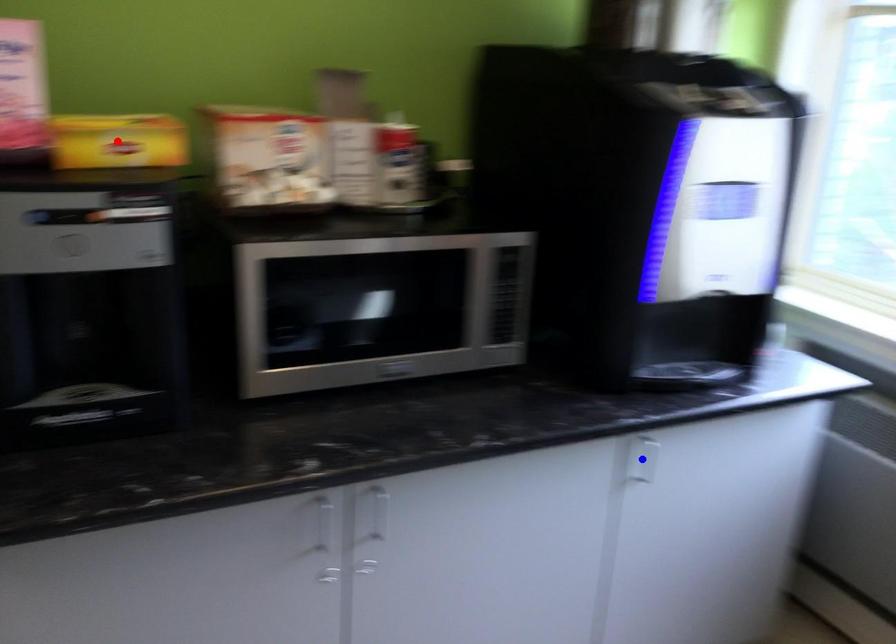
Question: Two points are marked on the image. Which point is closer to the camera?

Choices:
 (A) Blue point is closer.
 (B) Red point is closer.

Answer: (B)